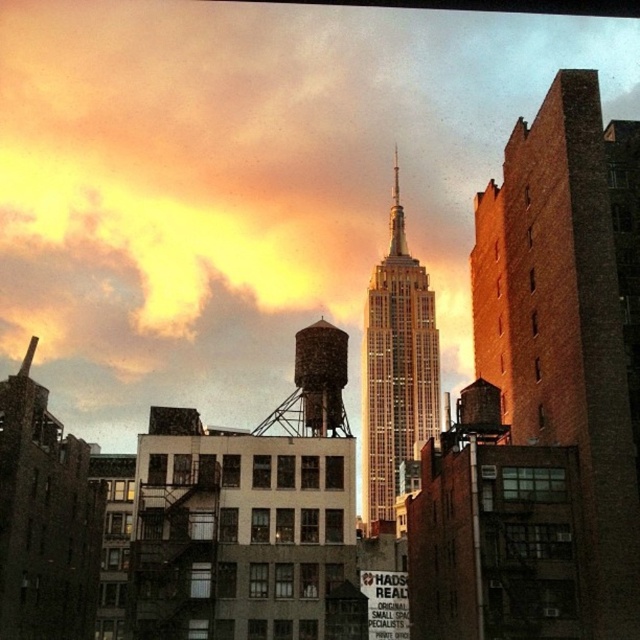
Question: Which of the following is the farthest from the observer?

Choices:
 (A) (428, 340)
 (B) (305, 314)

Answer: (B)

Question: Which point appears closest to the camera in this image?

Choices:
 (A) (339, 387)
 (B) (19, 145)
 (C) (390, 340)

Answer: (A)

Question: Does brick building at right have a greater width compared to gold glass skyscraper at center?

Choices:
 (A) yes
 (B) no

Answer: (B)

Question: Which point is farther to the camera?

Choices:
 (A) (490, 280)
 (B) (275, 291)

Answer: (B)

Question: Can you confirm if orange sky at upper center is positioned to the right of rustic metal water tower at center?

Choices:
 (A) no
 (B) yes

Answer: (A)

Question: Is gold glass skyscraper at center thinner than rustic metal water tower at center?

Choices:
 (A) yes
 (B) no

Answer: (B)